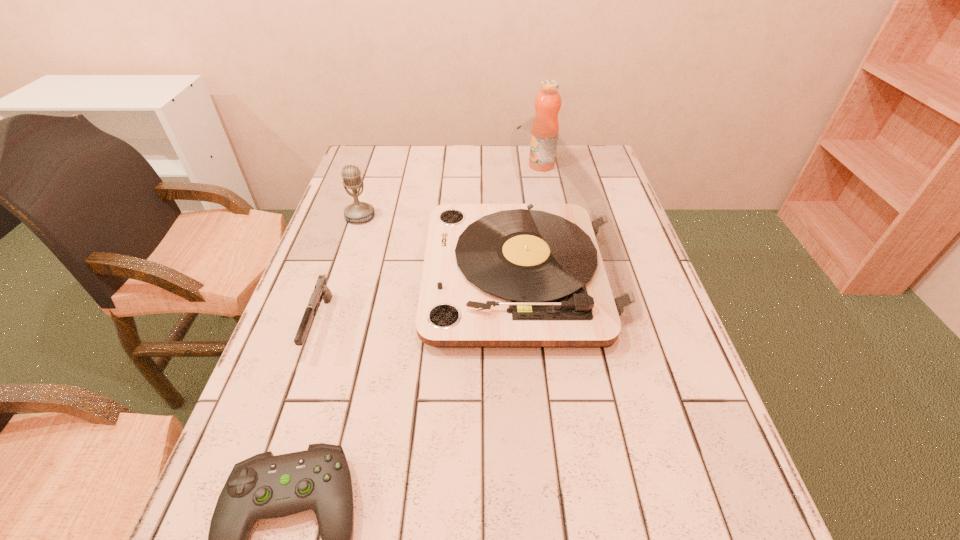
Identify the location of vacant area that lies between the third tallest object and the fourth tallest object. (340, 271).

I want to click on object identified as the closest to the nearest object, so click(321, 291).

Identify which object is the third nearest to the farthest object. Please provide its 2D coordinates. Your answer should be formatted as a tuple, i.e. [(x, y)], where the tuple contains the x and y coordinates of a point satisfying the conditions above.

[(321, 291)]

Locate an element on the screen. This screenshot has width=960, height=540. free space that satisfies the following two spatial constraints: 1. on the front side of the fruit juice; 2. with the tonearm facing the front of the record player is located at coordinates (564, 277).